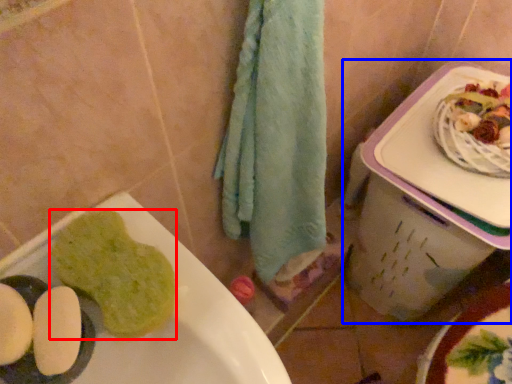
Question: Which point is further to the camera, food (highlighted by a red box) or lunch box (highlighted by a blue box)?

Choices:
 (A) food
 (B) lunch box

Answer: (B)